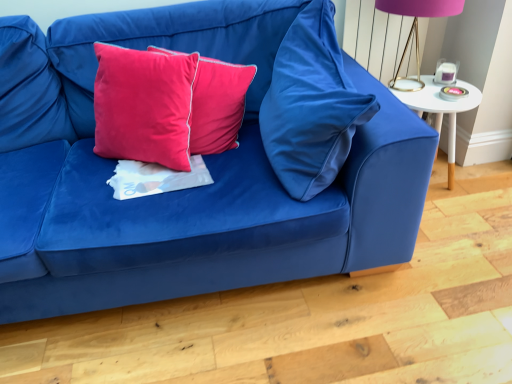
Question: Is velvet blue pillow at center, acting as the 1th pillow starting from the right, spatially inside velvet blue couch at center, or outside of it?

Choices:
 (A) outside
 (B) inside

Answer: (B)

Question: In the image, is velvet blue pillow at center, placed as the 3th pillow when sorted from left to right, positioned in front of or behind velvet blue couch at center?

Choices:
 (A) behind
 (B) front

Answer: (A)

Question: Which is farther from the satin pink pillow at center, the second pillow when ordered from right to left?

Choices:
 (A) velvet blue couch at center
 (B) velvet blue pillow at center, acting as the 1th pillow starting from the right
 (C) white matte sheet at center
 (D) purple fabric lampshade at upper right
 (E) velvet/cotton cushion at center, which is counted as the third pillow, starting from the right

Answer: (D)

Question: Estimate the real-world distances between objects in this image. Which object is farther from the white glossy side table at right?

Choices:
 (A) velvet blue couch at center
 (B) velvet blue pillow at center, placed as the 3th pillow when sorted from left to right
 (C) purple fabric lampshade at upper right
 (D) white matte sheet at center
 (E) satin pink pillow at center, the second pillow when ordered from right to left

Answer: (D)